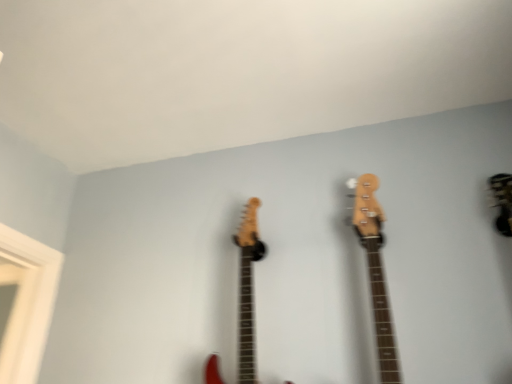
From the picture: What is the approximate height of glossy wood guitar at center?

glossy wood guitar at center is 24.33 inches in height.

This screenshot has width=512, height=384. Describe the element at coordinates (248, 289) in the screenshot. I see `glossy wood guitar at center` at that location.

Image resolution: width=512 pixels, height=384 pixels. Find the location of `glossy wood guitar at center`. glossy wood guitar at center is located at coordinates (248, 289).

Where is `glossy wood guitar at center`? Image resolution: width=512 pixels, height=384 pixels. glossy wood guitar at center is located at coordinates (248, 289).